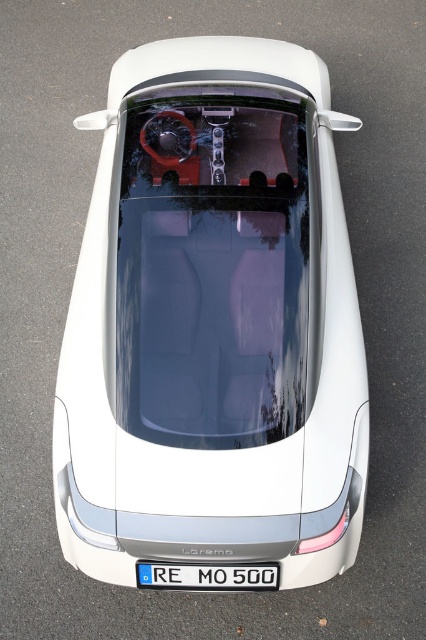
Consider the image. You are a delivery drone that needs to land on the roof of the white matte car at center. However, the transparent glass windshield at center might block your path. Based on their positions, can you safely land on the roof without hitting the windshield?

The white matte car at center is positioned on the left side of the transparent glass windshield at center, so the windshield is on the right side of the car. Since the drone needs to land on the roof, it can approach from the left side of the car where there is no windshield obstruction, allowing safe landing.

You are standing directly above the car and looking down. There is a point at coordinates (215,268). What object is located at this point?

The point at coordinates (215,268) indicates the transparent glass windshield at center.